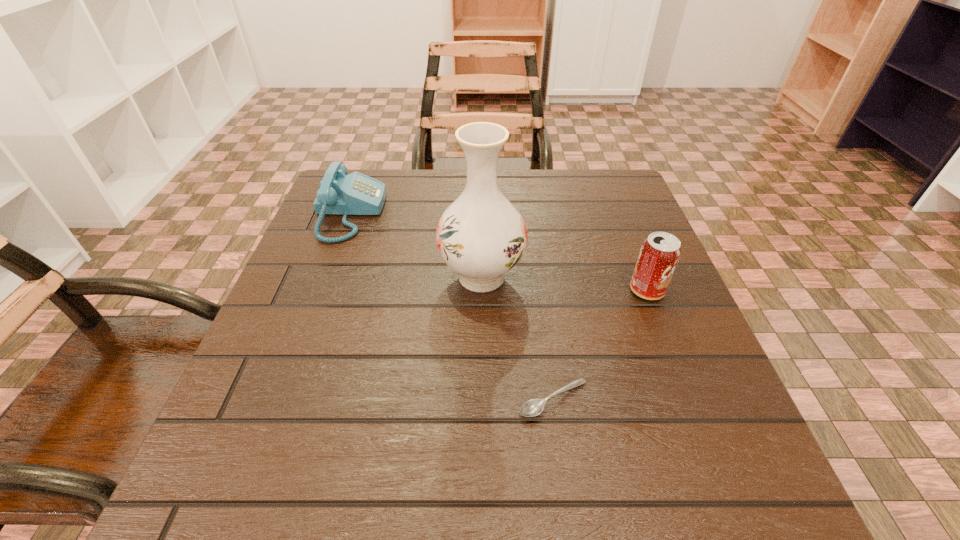
I want to click on vacant space that is in between the nearest object and the soda can, so click(x=600, y=345).

In order to click on empty location between the vase and the soda can in this screenshot , I will do `click(564, 283)`.

You are a GUI agent. You are given a task and a screenshot of the screen. Output one action in this format:
    pyautogui.click(x=<x>, y=<y>)
    Task: Click on the vacant space in between the vase and the second tallest object
    This screenshot has height=540, width=960.
    Given the screenshot: What is the action you would take?
    pyautogui.click(x=564, y=283)

The width and height of the screenshot is (960, 540). Identify the location of vacant space that's between the leftmost object and the soupspoon. (451, 306).

Identify the location of free spot between the tallest object and the rightmost object. coord(564,283).

You are a GUI agent. You are given a task and a screenshot of the screen. Output one action in this format:
    pyautogui.click(x=<x>, y=<y>)
    Task: Click on the free area in between the nearest object and the tallest object
    The image size is (960, 540).
    Given the screenshot: What is the action you would take?
    pyautogui.click(x=517, y=338)

What are the coordinates of `vacant area that lies between the third tallest object and the tallest object` in the screenshot? It's located at (416, 245).

I want to click on the closest object to the tallest object, so click(339, 193).

Identify the location of object that is the third closest to the shortest object. This screenshot has height=540, width=960. (339, 193).

Where is `vacant area in the image that satisfies the following two spatial constraints: 1. on the front side of the shortest object; 2. on the left side of the vase`? The width and height of the screenshot is (960, 540). vacant area in the image that satisfies the following two spatial constraints: 1. on the front side of the shortest object; 2. on the left side of the vase is located at coordinates (482, 399).